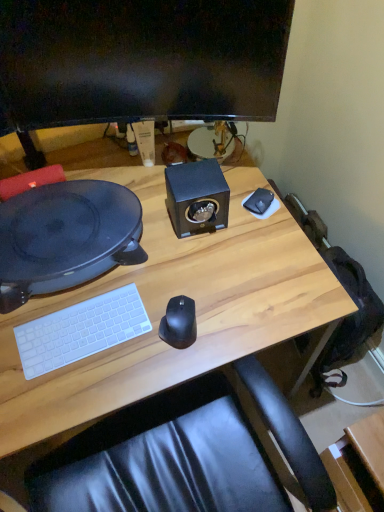
Where is `free area in between white matte keyboard at lower left and white matte mousepad at upper right`? The height and width of the screenshot is (512, 384). free area in between white matte keyboard at lower left and white matte mousepad at upper right is located at coordinates (174, 262).